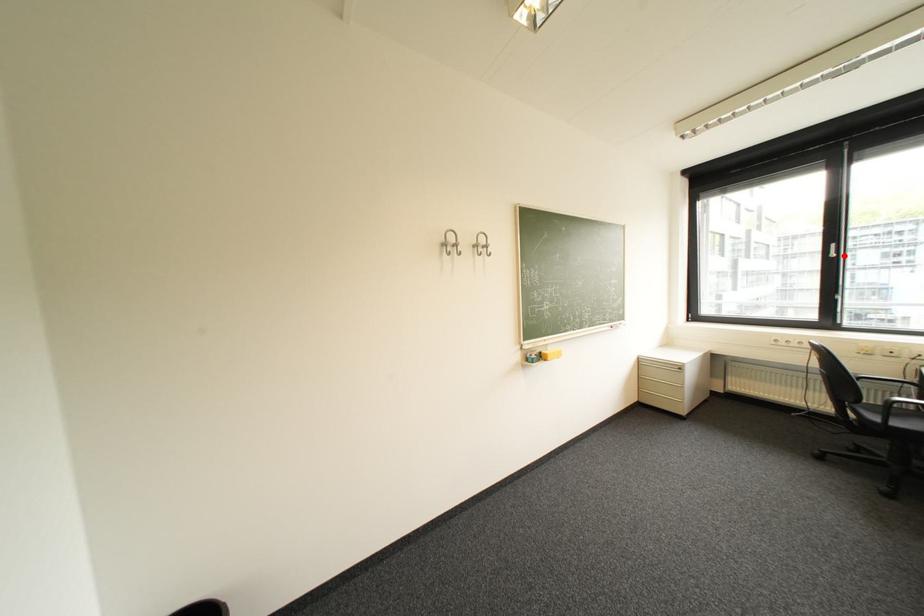
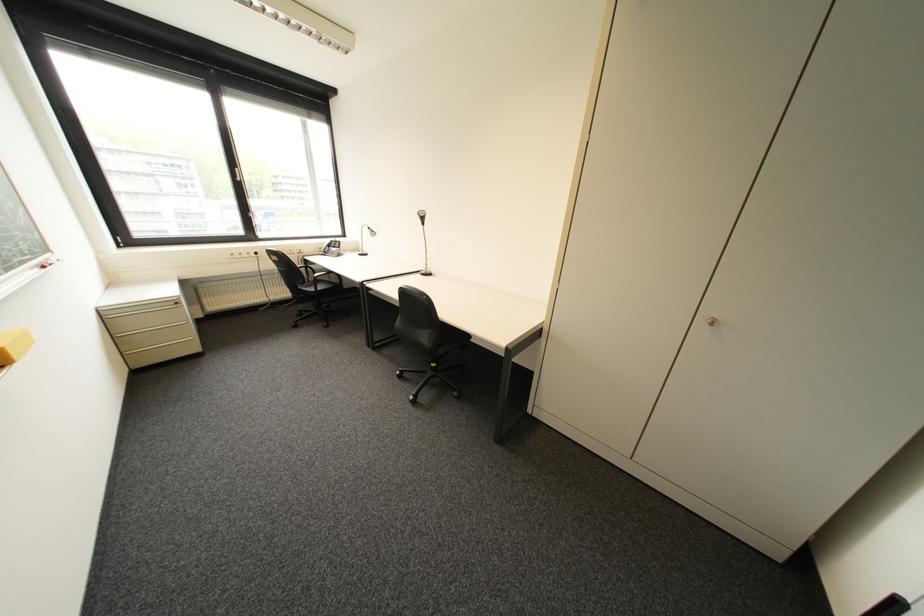
Find the pixel in the second image that matches the highlighted location in the first image.

(249, 180)